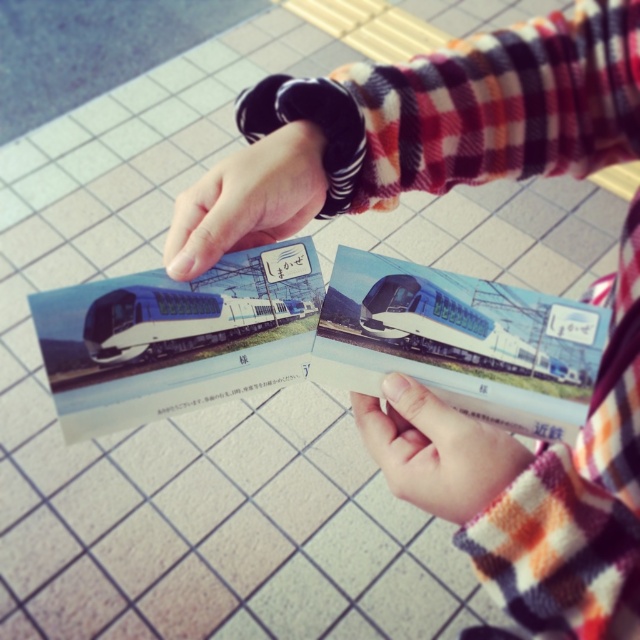
Question: Which of the following is the farthest from the observer?

Choices:
 (A) (436, 433)
 (B) (538, 598)

Answer: (A)

Question: Does smooth black wristwatch at upper center appear under metallic blue train at center?

Choices:
 (A) no
 (B) yes

Answer: (A)

Question: Based on their relative distances, which object is farther from the smooth black wristwatch at upper center?

Choices:
 (A) silver metallic train at center
 (B) plaid fabric arm at center
 (C) smooth skin hand at center

Answer: (C)

Question: Which point is farther to the camera?

Choices:
 (A) (465, 154)
 (B) (218, 225)
 (C) (225, 316)
 (D) (454, 307)

Answer: (A)

Question: Observing the image, what is the correct spatial positioning of smooth skin hand at center in reference to metallic blue train at center?

Choices:
 (A) right
 (B) left

Answer: (B)

Question: Is plaid fabric arm at center thinner than smooth black wristwatch at upper center?

Choices:
 (A) yes
 (B) no

Answer: (B)